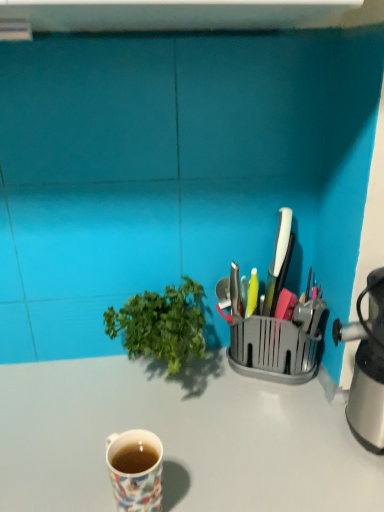
Find the location of a particular element. The height and width of the screenshot is (512, 384). vacant area situated to the left side of floral ceramic mug at lower left is located at coordinates (57, 471).